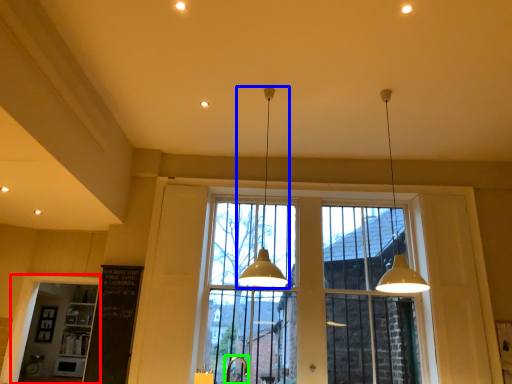
Question: Based on their relative distances, which object is farther from window frame (highlighted by a red box)? Choose from lamp (highlighted by a blue box) and faucet (highlighted by a green box).

Choices:
 (A) lamp
 (B) faucet

Answer: (A)